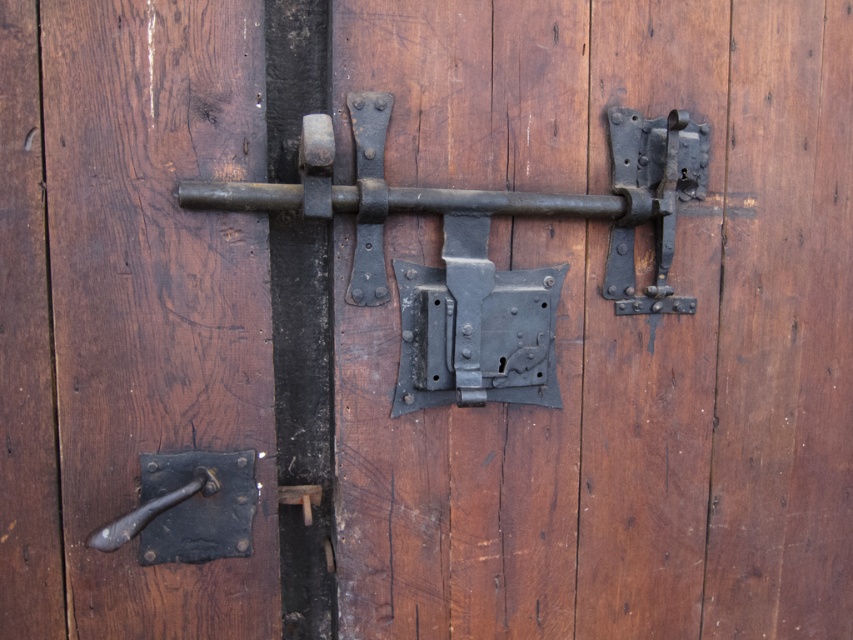
You are trying to open the door and see the matte black handle at left and the black matte metal bar at center. Which object should you move first to unlock the door?

You should move the matte black handle at left first because it is located below the black matte metal bar at center, indicating it might be the latch mechanism that needs to be operated before the handle can be used to open the door.

You are trying to open the door and notice two handles. The matte black handle at left and the dark brown metal handle at lower left. Which handle is larger in size?

The matte black handle at left is bigger than the dark brown metal handle at lower left.

You are a maintenance worker checking the door latch system. You need to adjust the black matte metal bar at center and the dark brown metal handle at lower left. Which object should you reach for first if you want to start with the one closer to you?

You should start with the black matte metal bar at center because it is closer to you than the dark brown metal handle at lower left.